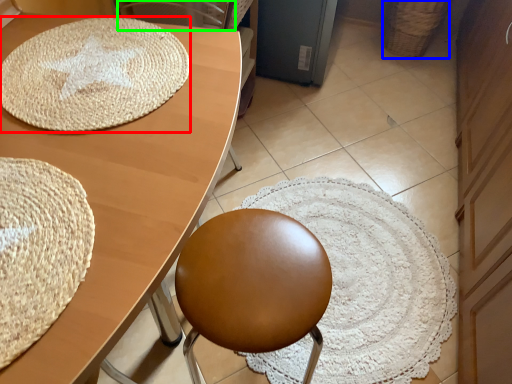
Question: Based on their relative distances, which object is nearer to mat (highlighted by a red box)? Choose from basket (highlighted by a blue box) and swivel chair (highlighted by a green box).

Choices:
 (A) basket
 (B) swivel chair

Answer: (B)